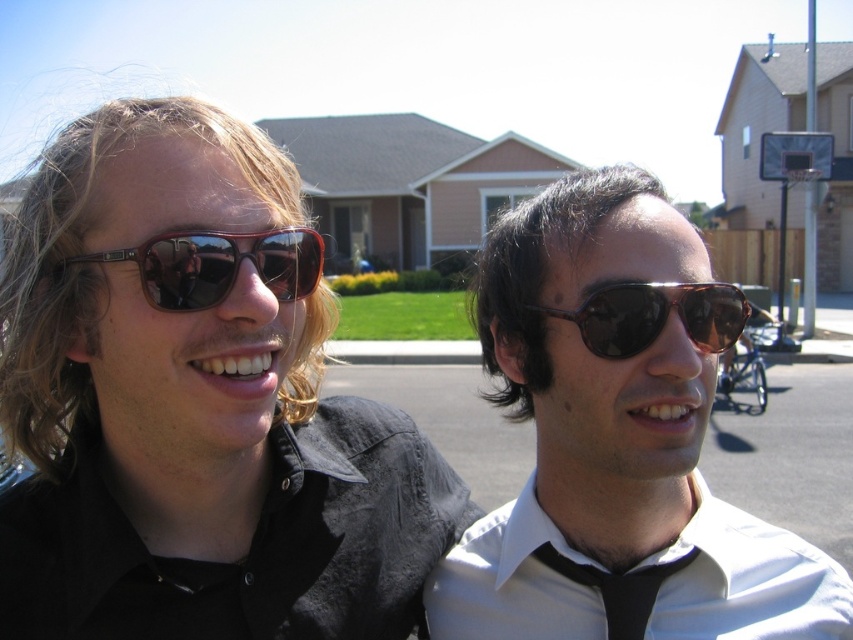
Question: Which of the following is the farthest from the observer?

Choices:
 (A) black satin tie at center
 (B) white smooth shirt at center
 (C) shiny brown sunglasses at center
 (D) matte brown sunglasses at left

Answer: (A)

Question: Is matte brown sunglasses at left closer to the viewer compared to black satin tie at center?

Choices:
 (A) yes
 (B) no

Answer: (A)

Question: Is white smooth shirt at center wider than shiny brown sunglasses at center?

Choices:
 (A) yes
 (B) no

Answer: (A)

Question: Which of the following is the farthest from the observer?

Choices:
 (A) (173, 310)
 (B) (711, 525)
 (C) (634, 310)
 (D) (595, 216)

Answer: (B)

Question: Does matte brown sunglasses at left have a lesser width compared to black satin tie at center?

Choices:
 (A) yes
 (B) no

Answer: (B)

Question: Which of the following is the closest to the observer?

Choices:
 (A) shiny brown sunglasses at center
 (B) white smooth shirt at center
 (C) matte brown sunglasses at left

Answer: (C)